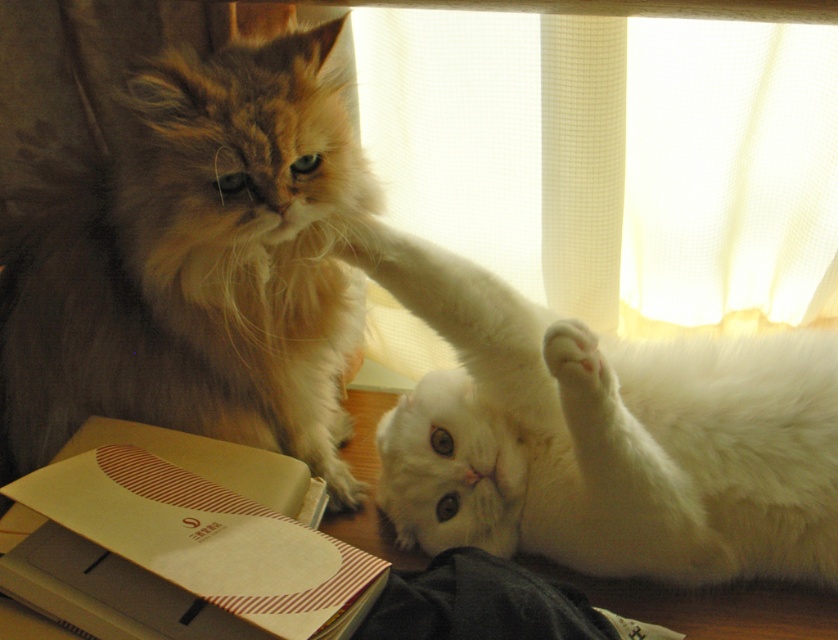
Question: Does white fluffy cat at lower right lie in front of white sheer curtain at upper center?

Choices:
 (A) yes
 (B) no

Answer: (A)

Question: Which point is farther from the camera taking this photo?

Choices:
 (A) (48, 410)
 (B) (808, 292)
 (C) (495, 324)

Answer: (B)

Question: Can you confirm if white sheer curtain at upper center is positioned below white fluffy paw at lower right?

Choices:
 (A) yes
 (B) no

Answer: (B)

Question: Which of the following is the closest to the observer?

Choices:
 (A) white fluffy cat at lower right
 (B) white fluffy paw at lower right

Answer: (B)

Question: Can you confirm if white fluffy cat at lower right is positioned to the right of white sheer curtain at upper center?

Choices:
 (A) no
 (B) yes

Answer: (A)

Question: Among these points, which one is farthest from the camera?

Choices:
 (A) (542, 339)
 (B) (552, 518)

Answer: (B)